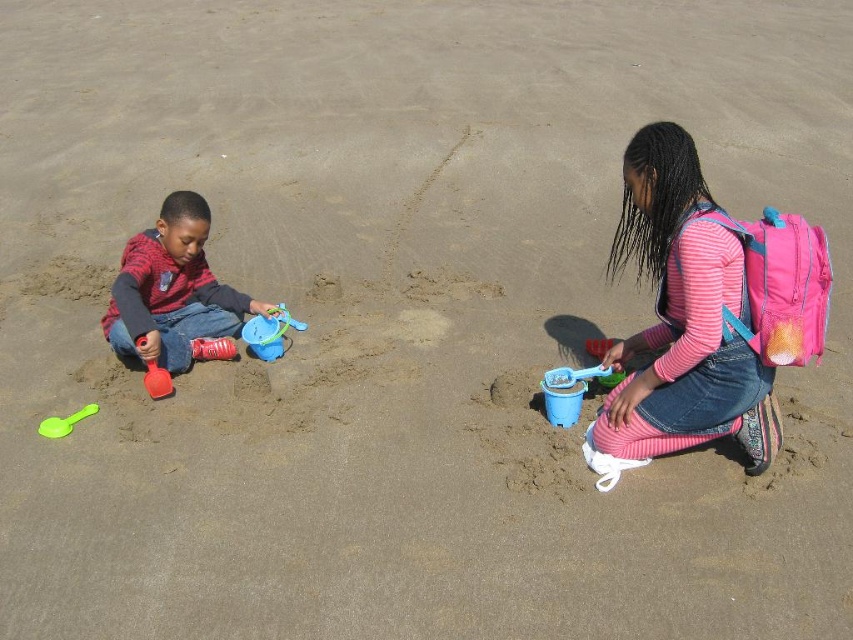
Which is more to the right, matte red shirt at left or blue plastic bucket at center-left?

blue plastic bucket at center-left

Is point (120, 292) farther from viewer compared to point (252, 344)?

No.

Identify the location of matte red shirt at left. This screenshot has width=853, height=640. (172, 289).

Which is more to the left, pink fabric backpack at right or rubber red shovel at left?

rubber red shovel at left is more to the left.

Between point (711, 429) and point (160, 392), which one is positioned behind?

Point (160, 392)

Which is behind, point (701, 301) or point (149, 388)?

Point (149, 388)

You are a GUI agent. You are given a task and a screenshot of the screen. Output one action in this format:
    pyautogui.click(x=<x>, y=<y>)
    Task: Click on the pink fabric backpack at right
    Image resolution: width=853 pixels, height=640 pixels.
    Given the screenshot: What is the action you would take?
    pyautogui.click(x=680, y=321)

Is pink fabric backpack at right to the right of green plastic spoon at lower left from the viewer's perspective?

Correct, you'll find pink fabric backpack at right to the right of green plastic spoon at lower left.

Describe the element at coordinates (680, 321) in the screenshot. I see `pink fabric backpack at right` at that location.

Who is more distant from viewer, (671,172) or (67,432)?

The point (67,432) is more distant.

Image resolution: width=853 pixels, height=640 pixels. In order to click on pink fabric backpack at right in this screenshot , I will do `click(680, 321)`.